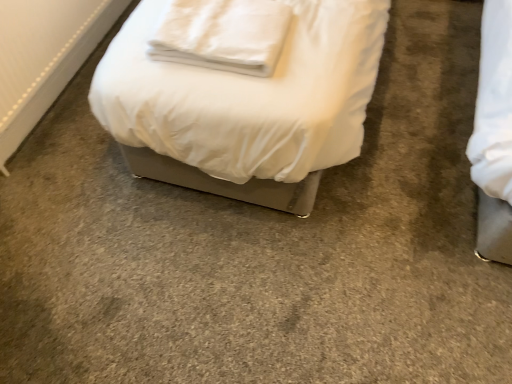
Describe the element at coordinates (223, 35) in the screenshot. I see `white soft pillow at upper center` at that location.

The image size is (512, 384). Identify the location of white soft pillow at upper center. (223, 35).

Describe the element at coordinates (44, 57) in the screenshot. Image resolution: width=512 pixels, height=384 pixels. I see `white fabric radiator at lower left` at that location.

Measure the distance between white fabric radiator at lower left and camera.

white fabric radiator at lower left is 1.50 meters away from camera.

Locate an element on the screen. Image resolution: width=512 pixels, height=384 pixels. white fabric radiator at lower left is located at coordinates (44, 57).

Where is `white soft pillow at upper center`? white soft pillow at upper center is located at coordinates (x=223, y=35).

Considering the relative positions of white soft pillow at upper center and white fabric radiator at lower left in the image provided, is white soft pillow at upper center to the right of white fabric radiator at lower left from the viewer's perspective?

Indeed, white soft pillow at upper center is positioned on the right side of white fabric radiator at lower left.

In the image, is white soft pillow at upper center positioned in front of or behind white fabric radiator at lower left?

In the image, white soft pillow at upper center appears in front of white fabric radiator at lower left.

Is point (215, 45) farther from viewer compared to point (42, 103)?

No, it is in front of (42, 103).

From the image's perspective, which one is positioned lower, white soft pillow at upper center or white fabric radiator at lower left?

white soft pillow at upper center.

From a real-world perspective, is white soft pillow at upper center positioned under white fabric radiator at lower left based on gravity?

No, from a real-world perspective, white soft pillow at upper center is not beneath white fabric radiator at lower left.

Between white soft pillow at upper center and white fabric radiator at lower left, which one has smaller width?

Thinner between the two is white fabric radiator at lower left.

Does white soft pillow at upper center have a lesser height compared to white fabric radiator at lower left?

No, white soft pillow at upper center is not shorter than white fabric radiator at lower left.

Can you confirm if white soft pillow at upper center is bigger than white fabric radiator at lower left?

Yes.

Would you say white soft pillow at upper center is inside or outside white fabric radiator at lower left?

white soft pillow at upper center is not enclosed by white fabric radiator at lower left.

Would you consider white soft pillow at upper center to be distant from white fabric radiator at lower left?

No, white soft pillow at upper center is not far away from white fabric radiator at lower left.

Is white soft pillow at upper center facing away from white fabric radiator at lower left?

white soft pillow at upper center is not turned away from white fabric radiator at lower left.

Identify the location of pillow above the white fabric radiator at lower left (from a real-world perspective). (223, 35).

Is white fabric radiator at lower left to the left of white soft pillow at upper center from the viewer's perspective?

Correct, you'll find white fabric radiator at lower left to the left of white soft pillow at upper center.

Is white fabric radiator at lower left further to the viewer compared to white soft pillow at upper center?

Yes, it is behind white soft pillow at upper center.

Is point (4, 29) farther from camera compared to point (183, 42)?

Yes, it is behind point (183, 42).

From the picture: From the image's perspective, relative to white soft pillow at upper center, is white fabric radiator at lower left above or below?

From the image's perspective, white fabric radiator at lower left appears above white soft pillow at upper center.

From a real-world perspective, which object rests below the other?

white fabric radiator at lower left, from a real-world perspective.

Does white fabric radiator at lower left have a lesser width compared to white soft pillow at upper center?

Yes.

Who is shorter, white fabric radiator at lower left or white soft pillow at upper center?

white fabric radiator at lower left is shorter.

Looking at the image, does white fabric radiator at lower left seem bigger or smaller compared to white soft pillow at upper center?

Considering their sizes, white fabric radiator at lower left takes up less space than white soft pillow at upper center.

Is white fabric radiator at lower left not within white soft pillow at upper center?

Absolutely, white fabric radiator at lower left is external to white soft pillow at upper center.

Is white fabric radiator at lower left not close to white soft pillow at upper center?

No, there isn't a large distance between white fabric radiator at lower left and white soft pillow at upper center.

Is white fabric radiator at lower left turned away from white soft pillow at upper center?

That's not correct — white fabric radiator at lower left is not looking away from white soft pillow at upper center.

Can you tell me how much white fabric radiator at lower left and white soft pillow at upper center differ in facing direction?

The angle between the facing direction of white fabric radiator at lower left and the facing direction of white soft pillow at upper center is 89.9 degrees.

You are a GUI agent. You are given a task and a screenshot of the screen. Output one action in this format:
    pyautogui.click(x=<x>, y=<y>)
    Task: Click on the radiator above the white soft pillow at upper center (from the image's perspective)
    
    Given the screenshot: What is the action you would take?
    pyautogui.click(x=44, y=57)

Where is `pillow located above the white fabric radiator at lower left (from a real-world perspective)`? pillow located above the white fabric radiator at lower left (from a real-world perspective) is located at coordinates (223, 35).

Identify the location of pillow on the right of white fabric radiator at lower left. (223, 35).